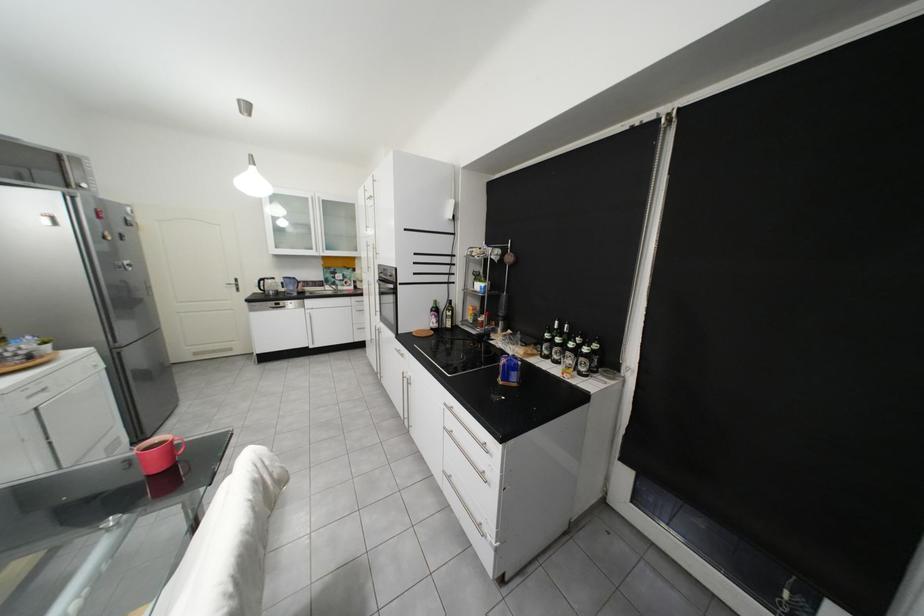
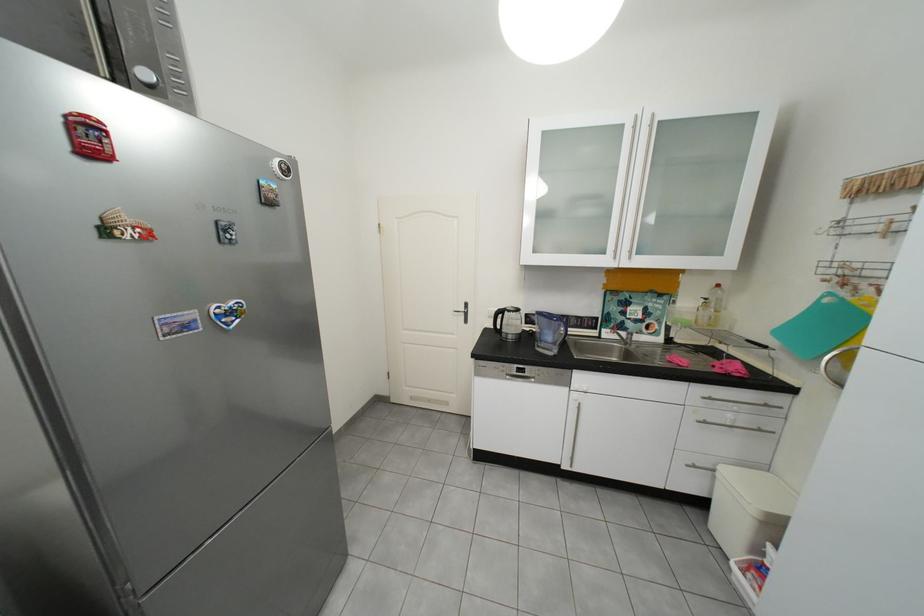
The point at (304, 290) is marked in the first image. Where is the corresponding point in the second image?

(561, 339)